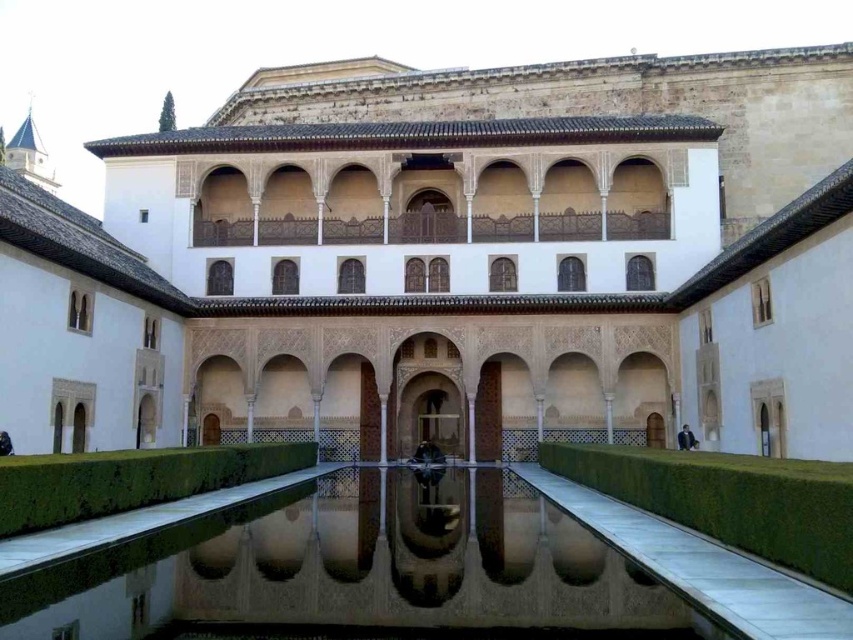
Measure the distance between white stone building at center and camera.

They are 41.72 meters apart.

Which of these two, white stone building at center or green stone moat at lower right, stands taller?

Standing taller between the two is white stone building at center.

Is point (103, 140) positioned after point (756, 481)?

Yes, point (103, 140) is farther from viewer.

Identify the location of white stone building at center. (451, 262).

Which is below, clear glass water at center or green stone moat at lower right?

clear glass water at center is lower down.

Is clear glass water at center smaller than green stone moat at lower right?

Indeed, clear glass water at center has a smaller size compared to green stone moat at lower right.

Between point (590, 625) and point (755, 456), which one is positioned in front?

Point (590, 625)

The height and width of the screenshot is (640, 853). What are the coordinates of `clear glass water at center` in the screenshot? It's located at (358, 570).

Is white stone building at center thinner than clear glass water at center?

No, white stone building at center is not thinner than clear glass water at center.

Which is more to the right, white stone building at center or clear glass water at center?

clear glass water at center is more to the right.

Locate an element on the screen. The image size is (853, 640). white stone building at center is located at coordinates (451, 262).

Identify the location of white stone building at center. The width and height of the screenshot is (853, 640). click(x=451, y=262).